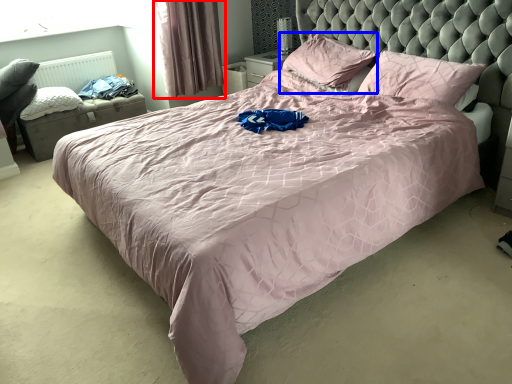
Question: Which object is closer to the camera taking this photo, curtain (highlighted by a red box) or pillow (highlighted by a blue box)?

Choices:
 (A) curtain
 (B) pillow

Answer: (B)